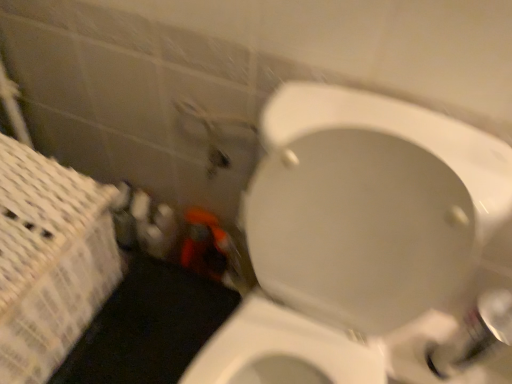
At what (x,y) coordinates should I click in order to perform the action: click on white glossy toilet at center. Please return your answer as a coordinate pair (x, y). Image resolution: width=512 pixels, height=384 pixels. Looking at the image, I should click on tap(359, 239).

In order to face white glossy toilet at center, should I rotate leftwards or rightwards?

To face it directly, rotate right by 6.695 degrees.

This screenshot has height=384, width=512. Describe the element at coordinates (359, 239) in the screenshot. I see `white glossy toilet at center` at that location.

This screenshot has height=384, width=512. I want to click on white glossy toilet at center, so click(x=359, y=239).